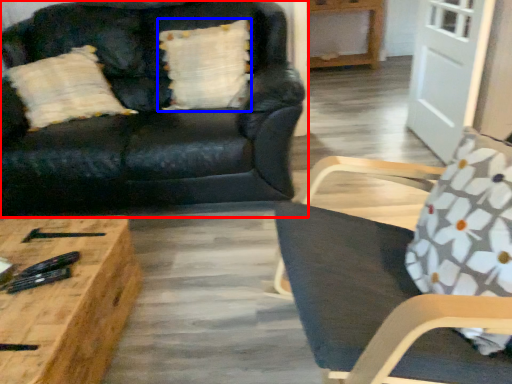
Question: Among these objects, which one is farthest to the camera, studio couch (highlighted by a red box) or pillow (highlighted by a blue box)?

Choices:
 (A) studio couch
 (B) pillow

Answer: (B)